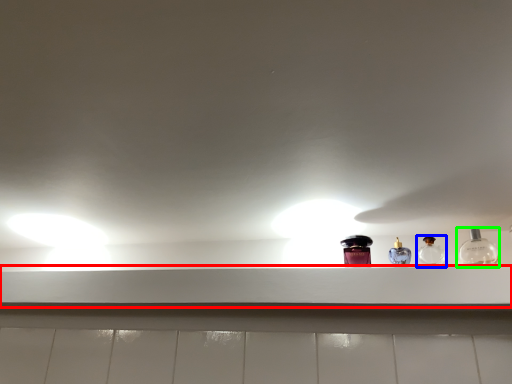
Question: Estimate the real-world distances between objects in this image. Which object is closer to window sill (highlighted by a red box), bottle (highlighted by a blue box) or bottle (highlighted by a green box)?

Choices:
 (A) bottle
 (B) bottle

Answer: (A)